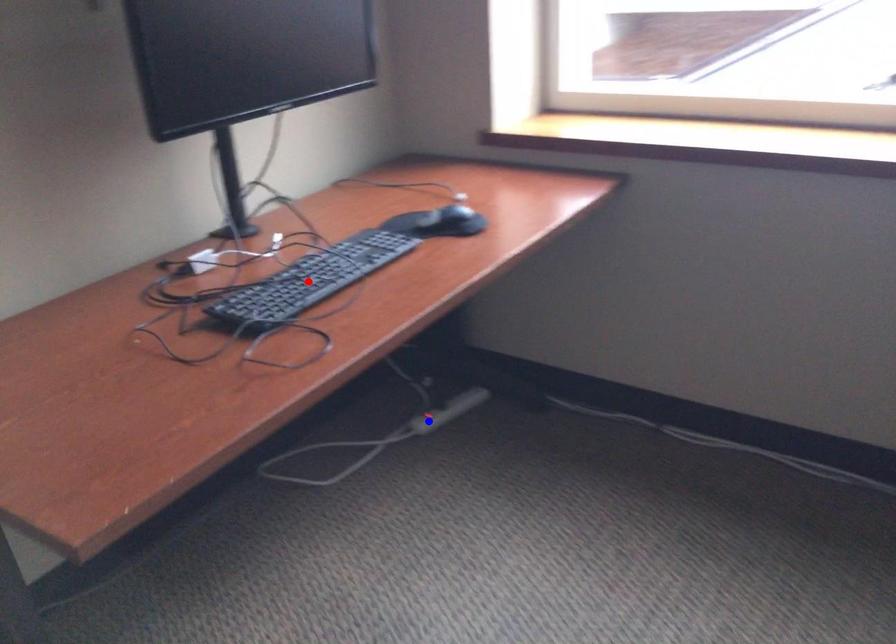
Question: Two points are marked on the image. Which point is closer to the camera?

Choices:
 (A) Blue point is closer.
 (B) Red point is closer.

Answer: (B)